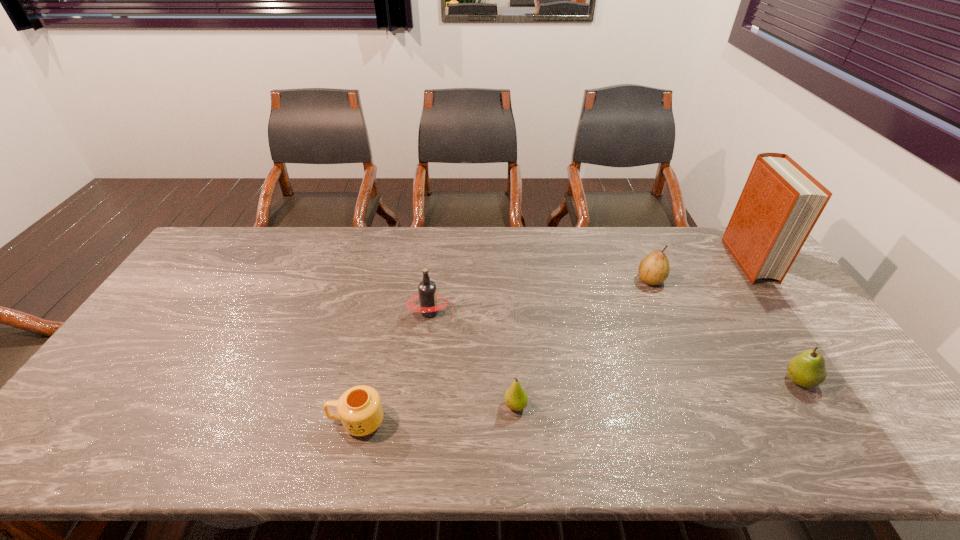
Point out which object is positioned as the second nearest to the fifth shortest object. Please provide its 2D coordinates. Your answer should be formatted as a tuple, i.e. [(x, y)], where the tuple contains the x and y coordinates of a point satisfying the conditions above.

[(515, 397)]

Locate which object ranks second in proximity to the fifth object from right to left. Please provide its 2D coordinates. Your answer should be formatted as a tuple, i.e. [(x, y)], where the tuple contains the x and y coordinates of a point satisfying the conditions above.

[(515, 397)]

Identify which pear is located as the second nearest to the second nearest pear. Please provide its 2D coordinates. Your answer should be formatted as a tuple, i.e. [(x, y)], where the tuple contains the x and y coordinates of a point satisfying the conditions above.

[(515, 397)]

This screenshot has width=960, height=540. I want to click on the second closest pear relative to the hardback book, so click(x=807, y=369).

At what (x,y) coordinates should I click in order to perform the action: click on free region that satisfies the following two spatial constraints: 1. on the label of the nearest pear; 2. on the right side of the fourth nearest object. Please return your answer as a coordinate pair (x, y). This screenshot has width=960, height=540. Looking at the image, I should click on (420, 406).

Locate an element on the screen. The height and width of the screenshot is (540, 960). free location that satisfies the following two spatial constraints: 1. on the back side of the fifth object from left to right; 2. on the right side of the nearest pear is located at coordinates (514, 381).